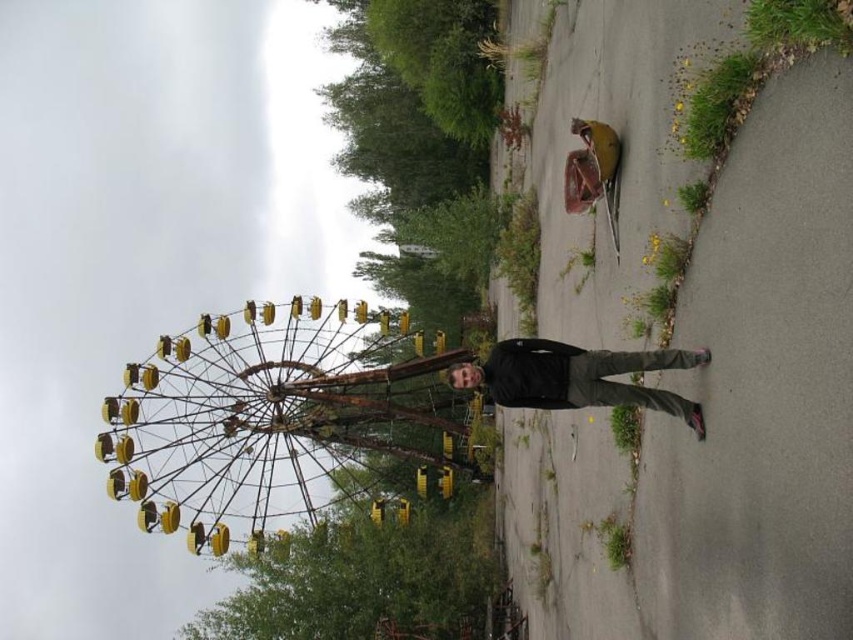
You are a photographer trying to capture the rusty yellow ferris wheel at left and the black matte jacket at center in a single frame. Based on their positions, which object should you focus on first to ensure both are in the frame?

The rusty yellow ferris wheel at left is below the black matte jacket at center, so you should focus on the black matte jacket at center first to ensure both are in the frame.

You are a photographer trying to capture the rusty yellow ferris wheel at left and the black matte jacket at center in the same frame. Based on their sizes, which object should you focus on first to ensure both fit in the frame?

The rusty yellow ferris wheel at left is wider than the black matte jacket at center, so you should focus on capturing the rusty yellow ferris wheel at left first to ensure both objects fit in the frame.

Looking at this image, you are a photographer trying to capture the rusty yellow ferris wheel at left and the black matte jacket at center in the same frame. Based on their positions, which object should you focus on first to ensure both are in the shot?

The rusty yellow ferris wheel at left is to the left of the black matte jacket at center, so you should focus on the black matte jacket at center first to ensure both are in the shot.